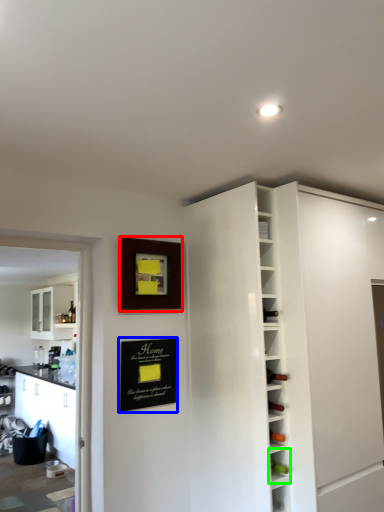
Question: Considering the real-world distances, which object is farthest from picture frame (highlighted by a red box)? bulletin board (highlighted by a blue box) or shelf (highlighted by a green box)?

Choices:
 (A) bulletin board
 (B) shelf

Answer: (B)